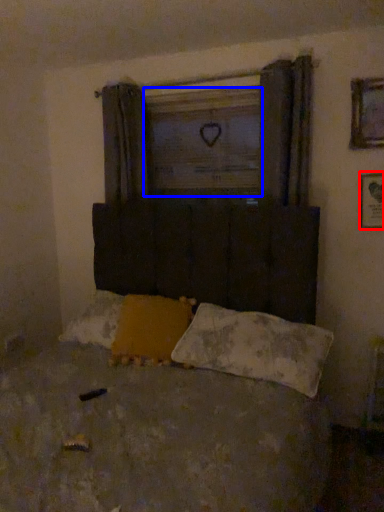
Question: Among these objects, which one is farthest to the camera, picture frame (highlighted by a red box) or window screen (highlighted by a blue box)?

Choices:
 (A) picture frame
 (B) window screen

Answer: (B)